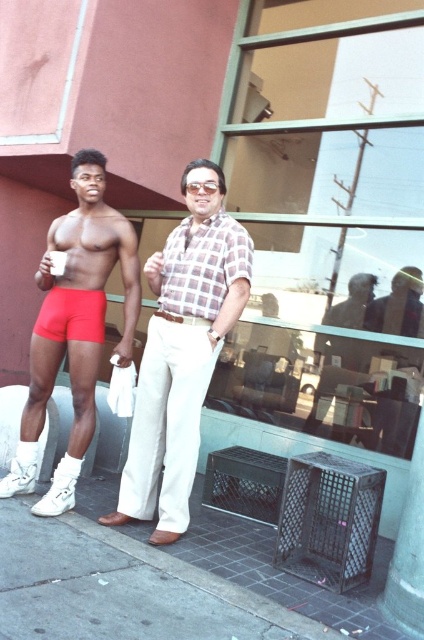
Question: Estimate the real-world distances between objects in this image. Which object is closer to the matte plaid shirt at center?

Choices:
 (A) gray concrete curb at lower left
 (B) checkered fabric shirt at center

Answer: (B)

Question: Among these points, which one is nearest to the camera?

Choices:
 (A) coord(75,330)
 (B) coord(142,424)
 (C) coord(209,227)

Answer: (C)

Question: Does gray concrete curb at lower left lie behind matte red shorts at left?

Choices:
 (A) yes
 (B) no

Answer: (B)

Question: Estimate the real-world distances between objects in this image. Which object is closer to the matte red shorts at center?

Choices:
 (A) checkered fabric shirt at center
 (B) matte red shorts at left
 (C) matte plaid shirt at center

Answer: (B)

Question: In this image, where is matte plaid shirt at center located relative to matte red shorts at center?

Choices:
 (A) below
 (B) above

Answer: (A)

Question: Is matte red shorts at center in front of checkered fabric shirt at center?

Choices:
 (A) yes
 (B) no

Answer: (B)